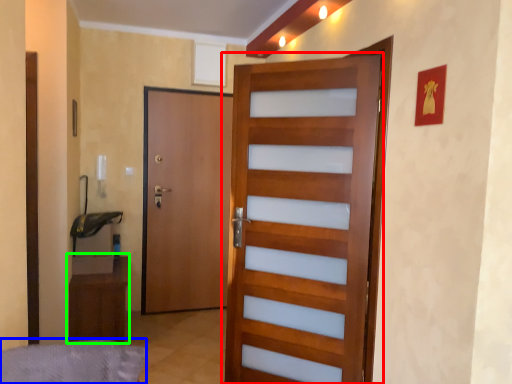
Question: Which is farther away from door (highlighted by a red box)? bed frame (highlighted by a blue box) or furniture (highlighted by a green box)?

Choices:
 (A) bed frame
 (B) furniture

Answer: (B)